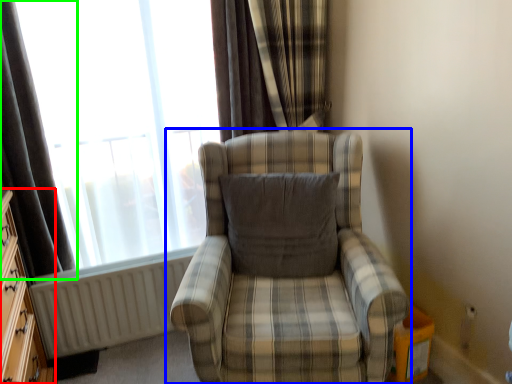
Question: Based on their relative distances, which object is farther from dresser (highlighted by a red box)? Choose from chair (highlighted by a blue box) and curtain (highlighted by a green box).

Choices:
 (A) chair
 (B) curtain

Answer: (A)